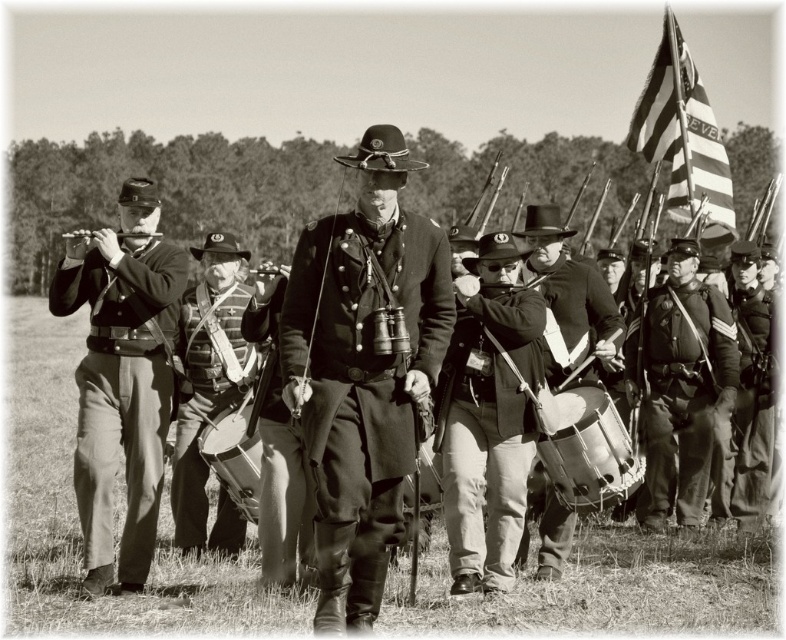
Who is lower down, matte black uniform at center or dark gray wool pants at right?

dark gray wool pants at right

Who is more distant from viewer, (x=127, y=163) or (x=768, y=420)?

The point (x=127, y=163) is more distant.

Which is in front, point (32, 348) or point (762, 298)?

Point (762, 298)

The image size is (786, 640). Find the location of `matte black uniform at center`. matte black uniform at center is located at coordinates (79, 529).

Is matte black uniform at left wider than striped fabric flag at upper right?

Yes.

How far apart are matte black uniform at left and striped fabric flag at upper right?

They are 13.81 meters apart.

Between point (122, 566) and point (689, 173), which one is positioned behind?

Positioned behind is point (689, 173).

Identify the location of matte black uniform at left. (120, 378).

Can you confirm if matte black uniform at center is shorter than rough woolen coat at center?

No, matte black uniform at center is not shorter than rough woolen coat at center.

Image resolution: width=786 pixels, height=640 pixels. I want to click on matte black uniform at center, so click(x=79, y=529).